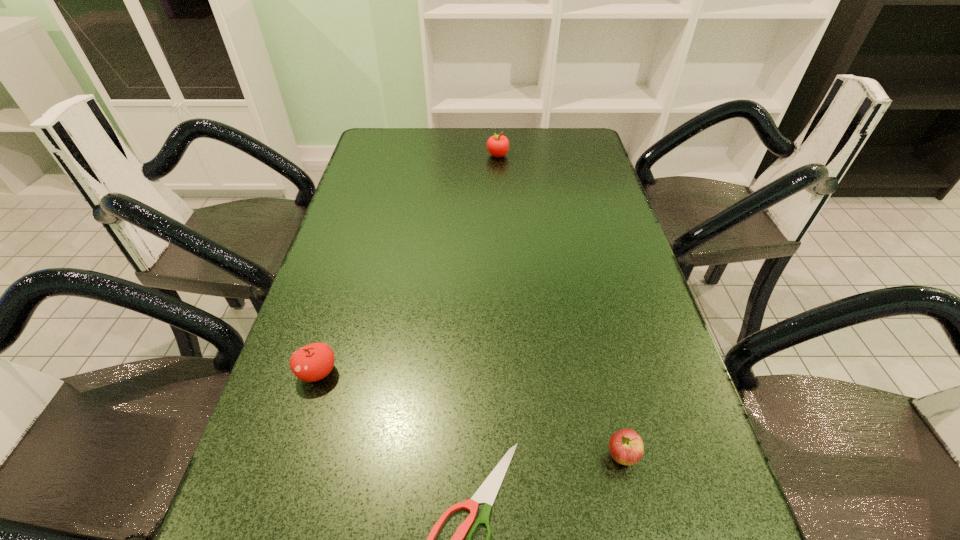
I want to click on free spot between the third nearest object and the nearest apple, so click(469, 414).

I want to click on free space that is in between the second apple from left to right and the rightmost object, so click(560, 306).

The image size is (960, 540). Find the location of `vacant point located between the rightmost apple and the second apple from right to left`. vacant point located between the rightmost apple and the second apple from right to left is located at coordinates (560, 306).

The height and width of the screenshot is (540, 960). Identify the location of free area in between the farthest object and the rightmost apple. (560, 306).

Locate an element on the screen. the closest object to the rightmost object is located at coordinates (487, 492).

This screenshot has height=540, width=960. Find the location of `the third closest object to the shortest object`. the third closest object to the shortest object is located at coordinates (497, 145).

Identify the location of the closest apple to the farthest object. (313, 362).

Select which apple is the second closest to the third nearest object. Please provide its 2D coordinates. Your answer should be formatted as a tuple, i.e. [(x, y)], where the tuple contains the x and y coordinates of a point satisfying the conditions above.

[(497, 145)]

The width and height of the screenshot is (960, 540). What are the coordinates of `free spot that satisfies the following two spatial constraints: 1. on the front side of the farthest apple; 2. on the left side of the nearest apple` in the screenshot? It's located at (515, 456).